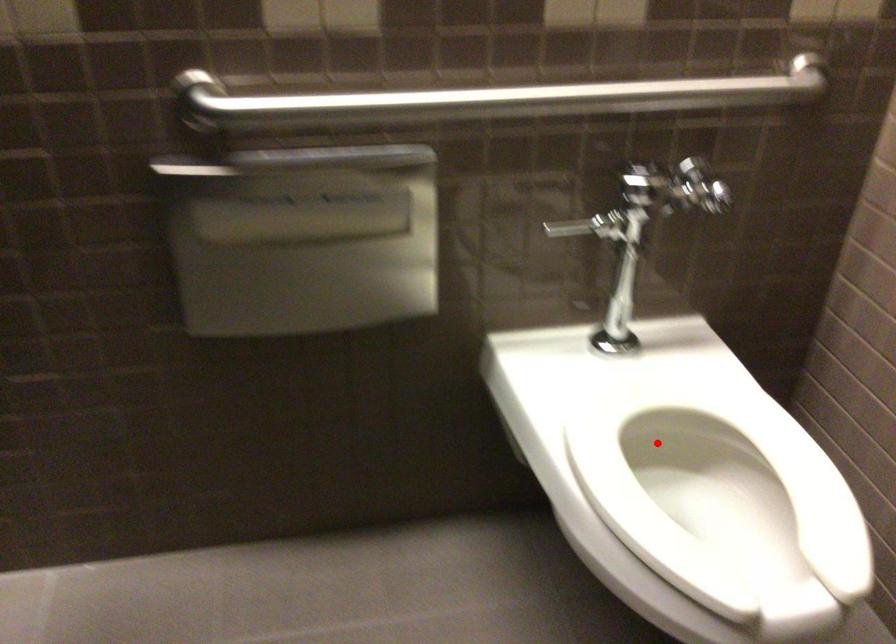
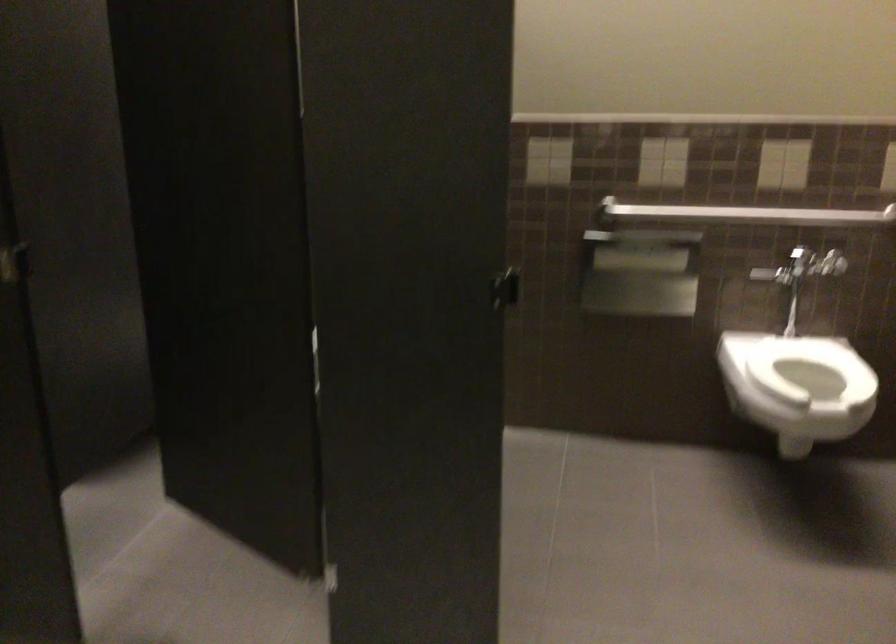
Question: I am providing you with two images of the same scene from different viewpoints. Given a red point in image1, look at the same physical point in image2. Is it:

Choices:
 (A) Closer to the viewpoint
 (B) Farther from the viewpoint

Answer: (B)